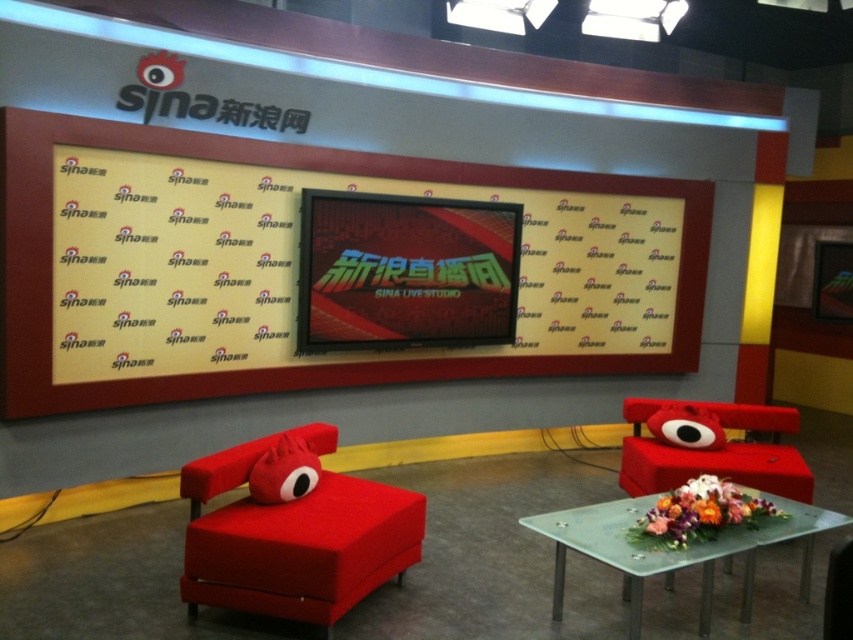
You are a technician setting up equipment in the Sina Live Studio. You need to place a monitor that must be positioned at coordinates between 0.4 and 0.45 on the x and y axes. Is the matte plastic bulletin board at upper center an appropriate location for this monitor?

The matte plastic bulletin board at upper center is located at point (321, 268), so the y coordinate is below 0.4. Therefore, it is not suitable for placing the monitor as the required y coordinate must be between 0.4 and 0.45.

You are a guest entering the studio and need to place a name tag on the matte plastic bulletin board at upper center. To reach it, you must walk around the transparent glass table at lower right. Which direction should you walk around the table to approach the bulletin board?

The matte plastic bulletin board at upper center is positioned on the left side of the transparent glass table at lower right, so you should walk around the right side of the transparent glass table at lower right to approach the bulletin board.